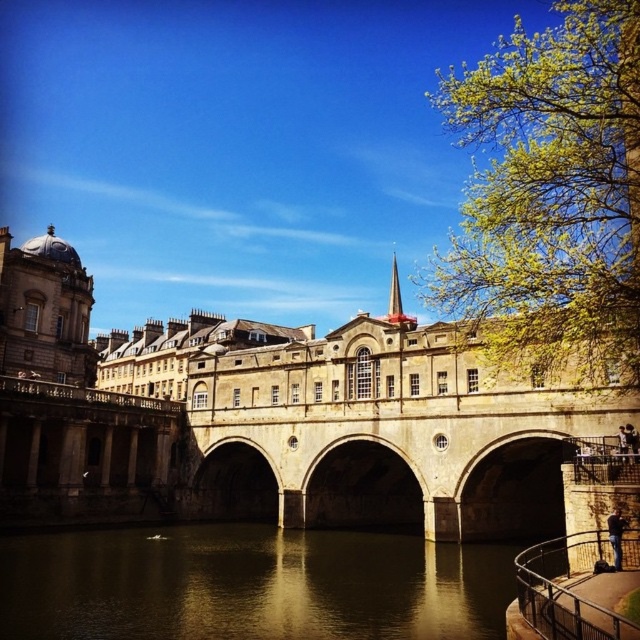
Question: Does stone bridge at center have a larger size compared to greenish reflective water at center?

Choices:
 (A) yes
 (B) no

Answer: (A)

Question: Is stone bridge at center in front of greenish reflective water at center?

Choices:
 (A) yes
 (B) no

Answer: (B)

Question: Does stone bridge at center appear on the right side of greenish reflective water at center?

Choices:
 (A) no
 (B) yes

Answer: (A)

Question: Which point is farther to the camera?

Choices:
 (A) (93, 540)
 (B) (346, 445)

Answer: (B)